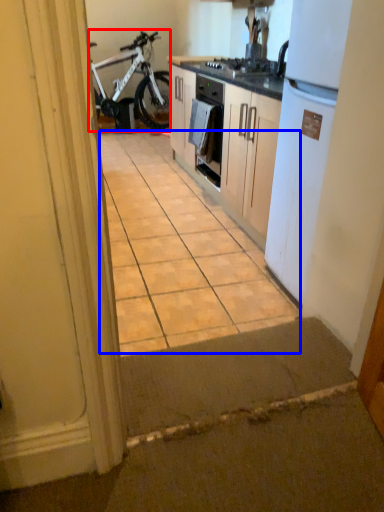
Question: Among these objects, which one is farthest to the camera, bicycle (highlighted by a red box) or ceramic tile (highlighted by a blue box)?

Choices:
 (A) bicycle
 (B) ceramic tile

Answer: (A)